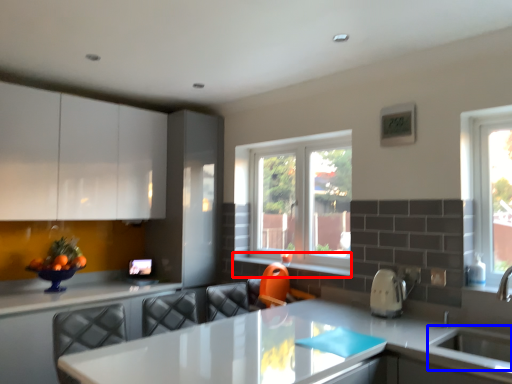
Question: Which object appears closest to the camera in this image, window sill (highlighted by a red box) or sink (highlighted by a blue box)?

Choices:
 (A) window sill
 (B) sink

Answer: (B)